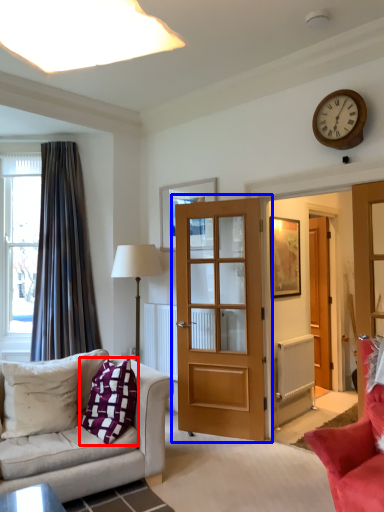
Question: Which object is closer to the camera taking this photo, pillow (highlighted by a red box) or door (highlighted by a blue box)?

Choices:
 (A) pillow
 (B) door

Answer: (A)